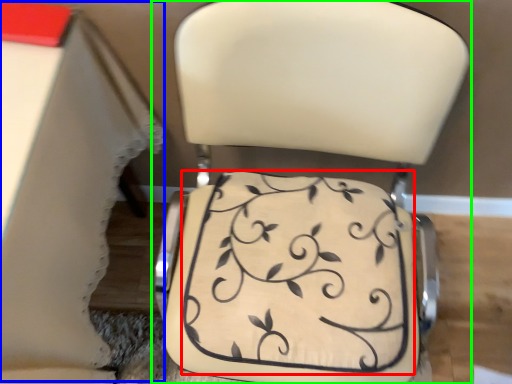
Question: Which is farther away from wedding cake (highlighted by a red box)? table (highlighted by a blue box) or chair (highlighted by a green box)?

Choices:
 (A) table
 (B) chair

Answer: (A)